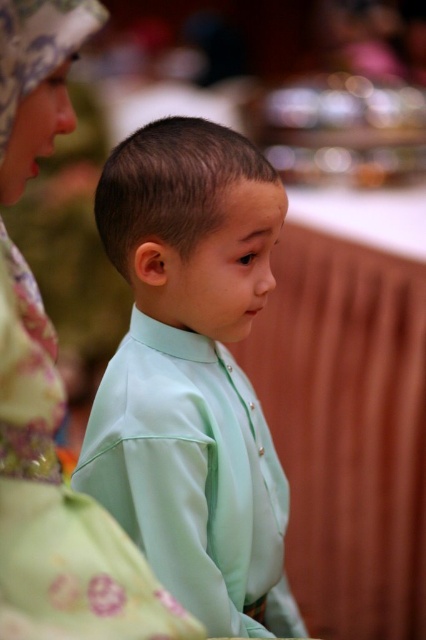
Question: Is light green satin shirt at center above matte green shirt at center?

Choices:
 (A) yes
 (B) no

Answer: (B)

Question: Does light green satin shirt at center have a larger size compared to matte green shirt at center?

Choices:
 (A) yes
 (B) no

Answer: (A)

Question: Which of the following is the closest to the observer?

Choices:
 (A) (40, 148)
 (B) (172, 388)

Answer: (A)

Question: Which of the following is the farthest from the observer?

Choices:
 (A) light green satin shirt at center
 (B) matte green shirt at center

Answer: (A)

Question: Which object is farther from the camera taking this photo?

Choices:
 (A) light green satin shirt at center
 (B) matte green shirt at center

Answer: (A)

Question: Is light green satin shirt at center closer to the viewer compared to matte green shirt at center?

Choices:
 (A) yes
 (B) no

Answer: (B)